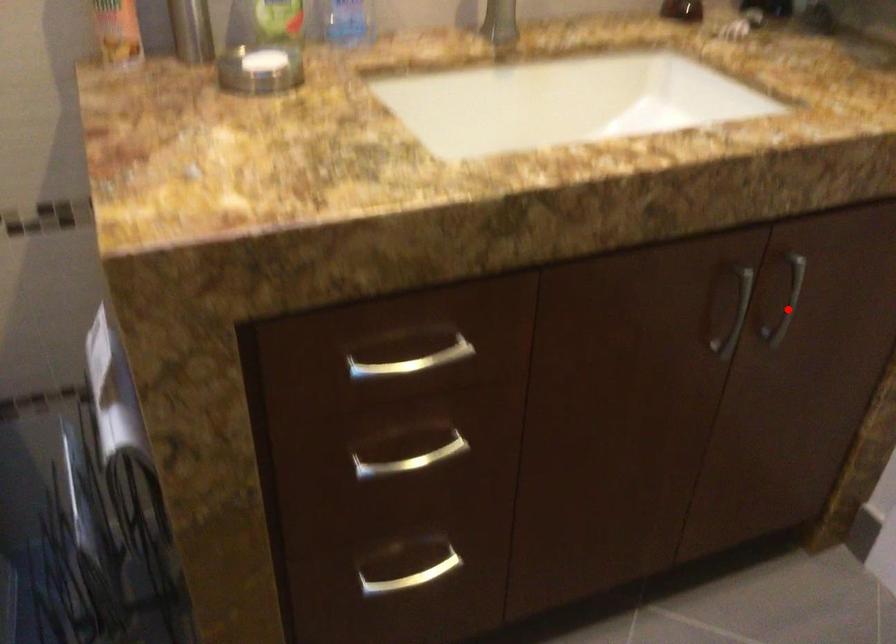
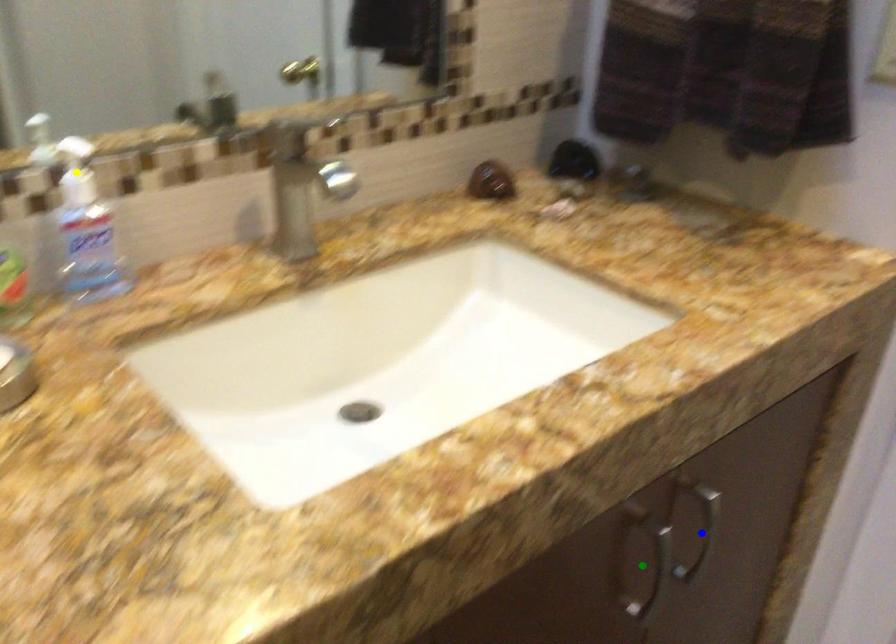
Question: I am providing you with two images of the same scene from different viewpoints. A red point is marked on the first image. You are given multiple points on the second image. Can you choose the point in image 2 that corresponds to the point in image 1?

Choices:
 (A) blue point
 (B) yellow point
 (C) green point

Answer: (A)